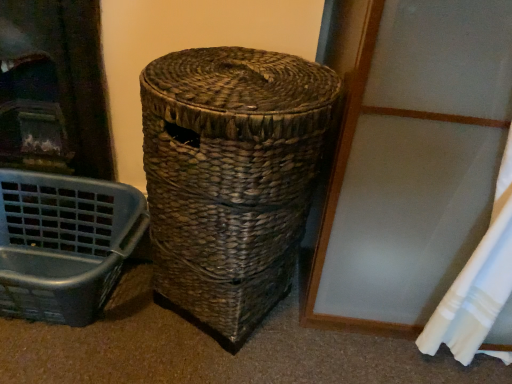
Question: From the image's perspective, is woven brown basket at center below matte plastic laundry basket at lower left?

Choices:
 (A) yes
 (B) no

Answer: (B)

Question: Is woven brown basket at center turned away from matte plastic laundry basket at lower left?

Choices:
 (A) no
 (B) yes

Answer: (A)

Question: Is woven brown basket at center outside of matte plastic laundry basket at lower left?

Choices:
 (A) no
 (B) yes

Answer: (B)

Question: From a real-world perspective, is woven brown basket at center below matte plastic laundry basket at lower left?

Choices:
 (A) yes
 (B) no

Answer: (B)

Question: Could you tell me if woven brown basket at center is facing matte plastic laundry basket at lower left?

Choices:
 (A) no
 (B) yes

Answer: (A)

Question: Is woven brown basket at center wider than matte plastic laundry basket at lower left?

Choices:
 (A) yes
 (B) no

Answer: (A)

Question: Is white fabric curtain at lower right thinner than matte plastic laundry basket at lower left?

Choices:
 (A) no
 (B) yes

Answer: (B)

Question: Would you say white fabric curtain at lower right contains matte plastic laundry basket at lower left?

Choices:
 (A) yes
 (B) no

Answer: (B)

Question: From the image's perspective, is white fabric curtain at lower right located above matte plastic laundry basket at lower left?

Choices:
 (A) yes
 (B) no

Answer: (A)

Question: Is white fabric curtain at lower right at the right side of matte plastic laundry basket at lower left?

Choices:
 (A) no
 (B) yes

Answer: (B)

Question: Is there a large distance between white fabric curtain at lower right and matte plastic laundry basket at lower left?

Choices:
 (A) yes
 (B) no

Answer: (B)

Question: Can you confirm if white fabric curtain at lower right is wider than matte plastic laundry basket at lower left?

Choices:
 (A) yes
 (B) no

Answer: (B)

Question: From a real-world perspective, is matte plastic laundry basket at lower left on white fabric curtain at lower right?

Choices:
 (A) yes
 (B) no

Answer: (B)